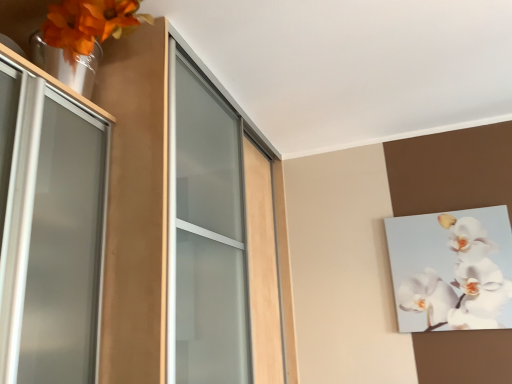
You are a GUI agent. You are given a task and a screenshot of the screen. Output one action in this format:
    pyautogui.click(x=<x>, y=<y>)
    Task: Click on the white glossy orchid at upper right
    
    Given the screenshot: What is the action you would take?
    pyautogui.click(x=458, y=280)

The width and height of the screenshot is (512, 384). What do you see at coordinates (458, 280) in the screenshot?
I see `white glossy orchid at upper right` at bounding box center [458, 280].

Locate an element on the screen. white glossy orchid at upper right is located at coordinates (458, 280).